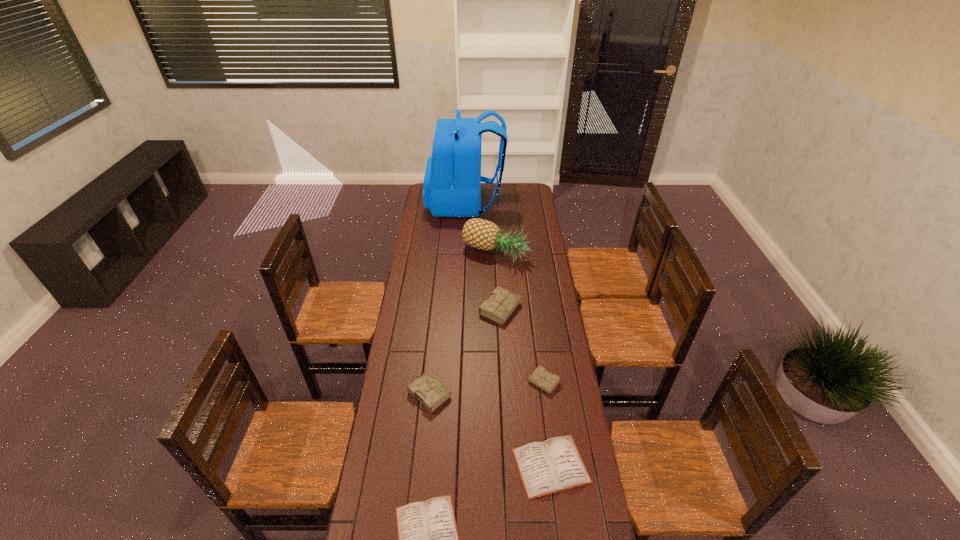
You are a GUI agent. You are given a task and a screenshot of the screen. Output one action in this format:
    pyautogui.click(x=<x>, y=<y>)
    Task: Click on the empty location between the second biggest green diary and the farthest object
    The height and width of the screenshot is (540, 960).
    Given the screenshot: What is the action you would take?
    pyautogui.click(x=447, y=298)

Select which object is the closest to the second farthest object. Please provide its 2D coordinates. Your answer should be formatted as a tuple, i.e. [(x, y)], where the tuple contains the x and y coordinates of a point satisfying the conditions above.

[(501, 304)]

Identify the location of the sixth closest object to the tallest object. Image resolution: width=960 pixels, height=540 pixels. (428, 539).

Locate an element on the screen. This screenshot has height=540, width=960. the second closest diary to the second biggest green diary is located at coordinates (501, 304).

Locate which diary ranks second in proximity to the second smallest green diary. Please provide its 2D coordinates. Your answer should be formatted as a tuple, i.e. [(x, y)], where the tuple contains the x and y coordinates of a point satisfying the conditions above.

[(501, 304)]

Choose which green diary is the second nearest neighbor to the backpack. Please provide its 2D coordinates. Your answer should be formatted as a tuple, i.e. [(x, y)], where the tuple contains the x and y coordinates of a point satisfying the conditions above.

[(541, 378)]

Point out which green diary is positioned as the third nearest to the pineapple. Please provide its 2D coordinates. Your answer should be formatted as a tuple, i.e. [(x, y)], where the tuple contains the x and y coordinates of a point satisfying the conditions above.

[(427, 389)]

You are a GUI agent. You are given a task and a screenshot of the screen. Output one action in this format:
    pyautogui.click(x=<x>, y=<y>)
    Task: Click on the vacant space that satisfies the following two spatial constraints: 1. on the front side of the farthest diary; 2. on the right side of the sixth nearest object
    This screenshot has width=960, height=540.
    Given the screenshot: What is the action you would take?
    pyautogui.click(x=498, y=309)

Image resolution: width=960 pixels, height=540 pixels. I want to click on free space that satisfies the following two spatial constraints: 1. on the back side of the leftmost green diary; 2. on the right side of the second farthest object, so click(444, 254).

This screenshot has height=540, width=960. In order to click on free location that satisfies the following two spatial constraints: 1. on the back side of the biggest green diary; 2. on the right side of the leftmost green diary in this screenshot , I will do `click(438, 309)`.